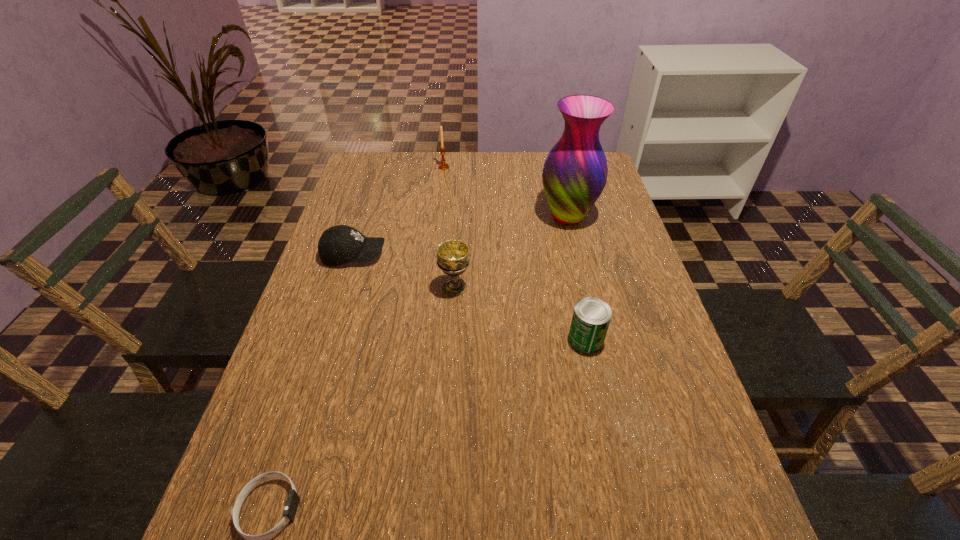
The height and width of the screenshot is (540, 960). What are the coordinates of `vacant space that satisfies the following two spatial constraints: 1. on the front-facing side of the baseball cap; 2. on the back side of the fifth farthest object` in the screenshot? It's located at (327, 339).

At what (x,y) coordinates should I click in order to perform the action: click on free space that satisfies the following two spatial constraints: 1. on the front-facing side of the chalice; 2. on the right side of the baseball cap. Please return your answer as a coordinate pair (x, y). Looking at the image, I should click on (344, 287).

Locate an element on the screen. The height and width of the screenshot is (540, 960). free point that satisfies the following two spatial constraints: 1. on the front-facing side of the fourth nearest object; 2. on the back side of the fifth farthest object is located at coordinates (327, 339).

Find the location of `vacant space that satisfies the following two spatial constraints: 1. on the front-facing side of the fourth nearest object; 2. on the right side of the can`. vacant space that satisfies the following two spatial constraints: 1. on the front-facing side of the fourth nearest object; 2. on the right side of the can is located at coordinates (327, 339).

The width and height of the screenshot is (960, 540). In order to click on free location that satisfies the following two spatial constraints: 1. on the back side of the fifth farthest object; 2. on the front-facing side of the baseball cap in this screenshot , I will do `click(567, 255)`.